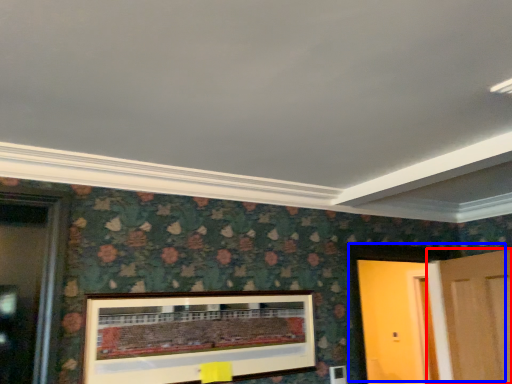
Question: Among these objects, which one is farthest to the camera, door (highlighted by a red box) or door (highlighted by a blue box)?

Choices:
 (A) door
 (B) door

Answer: (B)